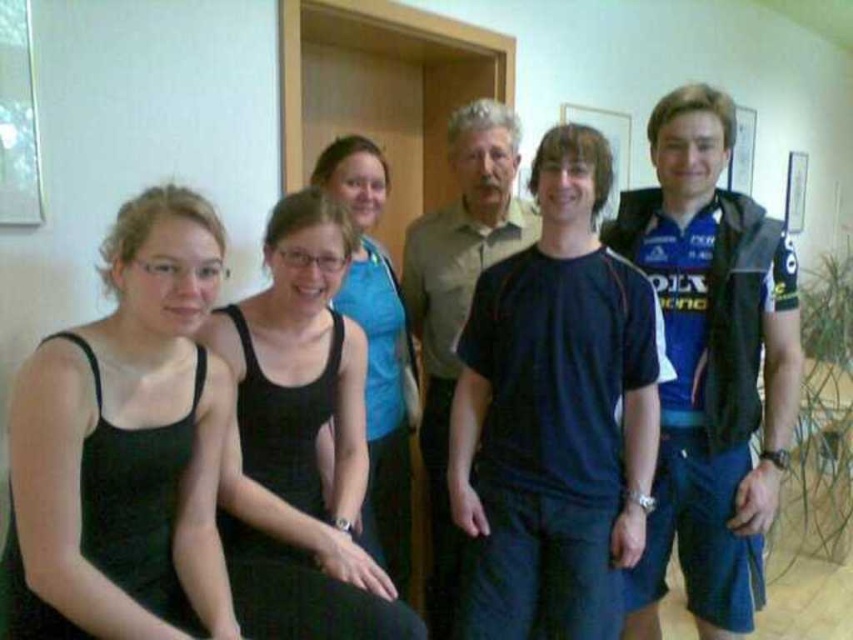
Is dark blue fabric shirt at center above black matte tank top at left?

Yes, dark blue fabric shirt at center is above black matte tank top at left.

Does point (537, 342) come behind point (129, 240)?

Yes, it is behind point (129, 240).

Does point (624, 540) lie behind point (59, 364)?

That is True.

The height and width of the screenshot is (640, 853). I want to click on dark blue fabric shirt at center, so click(554, 417).

Based on the photo, is dark blue fabric shirt at center shorter than black fabric tank top at center?

Incorrect, dark blue fabric shirt at center's height does not fall short of black fabric tank top at center's.

Does dark blue fabric shirt at center come behind black fabric tank top at center?

Yes.

Is point (523, 376) behind point (310, 509)?

Yes, it is.

Find the location of `dark blue fabric shirt at center`. dark blue fabric shirt at center is located at coordinates (554, 417).

Looking at this image, does black matte tank top at left have a smaller size compared to black fabric tank top at center?

Yes, black matte tank top at left is smaller than black fabric tank top at center.

Is point (90, 608) farther from viewer compared to point (306, 611)?

No, it is in front of (306, 611).

Image resolution: width=853 pixels, height=640 pixels. Describe the element at coordinates (125, 444) in the screenshot. I see `black matte tank top at left` at that location.

What are the coordinates of `black matte tank top at left` in the screenshot? It's located at pyautogui.click(x=125, y=444).